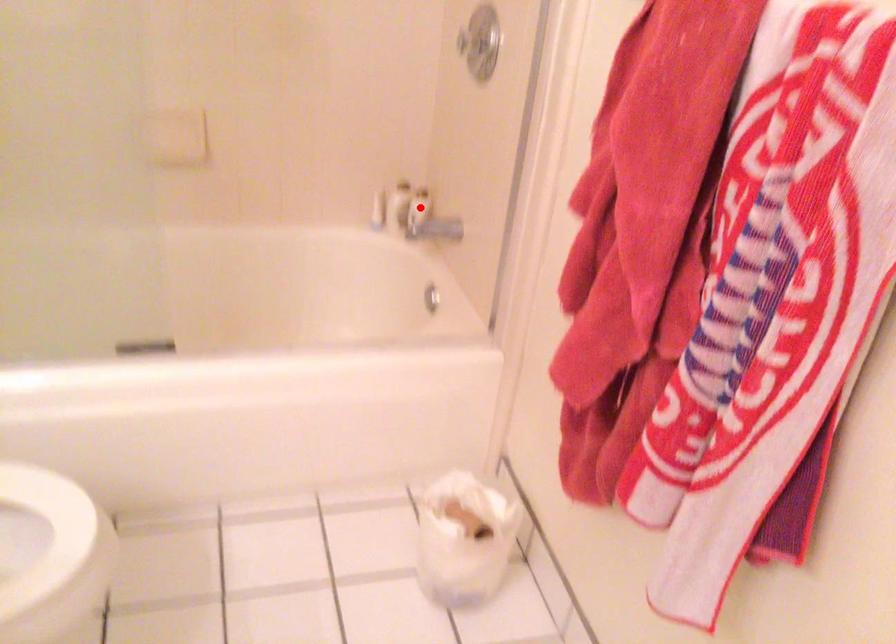
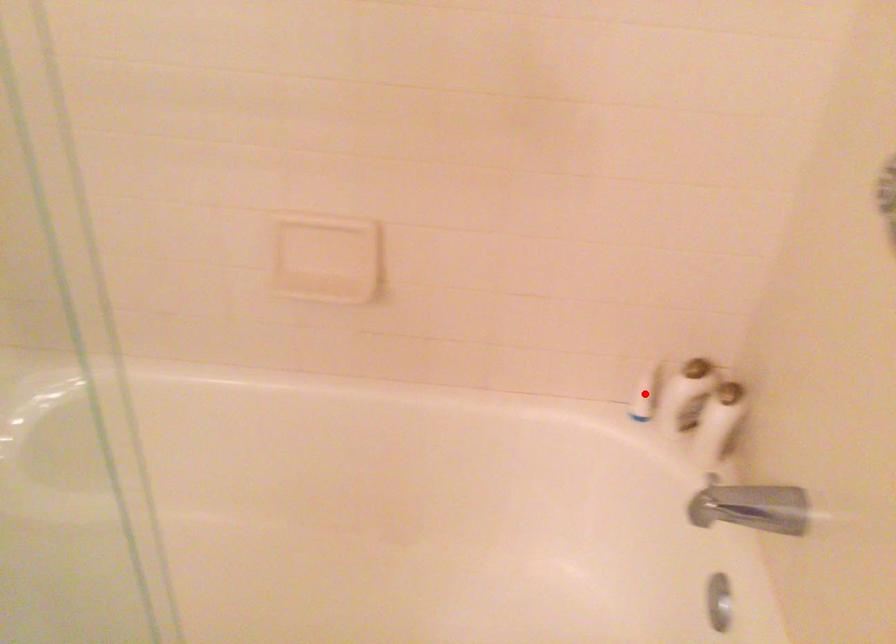
I am providing you with two images of the same scene from different viewpoints. A red point is marked on the first image and another point is marked on the second image. Is the red point in image1 aligned with the point shown in image2?

No